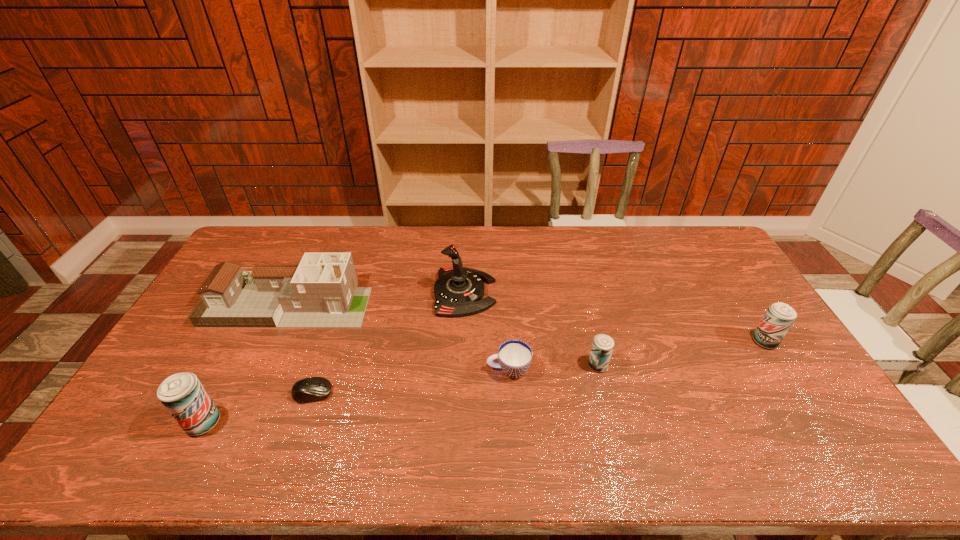
The image size is (960, 540). Find the location of `the leftmost beer can`. the leftmost beer can is located at coordinates pos(182,394).

The image size is (960, 540). I want to click on the tallest beer can, so click(182, 394).

Find the location of `the shortest beer can`. the shortest beer can is located at coordinates (602, 347).

The width and height of the screenshot is (960, 540). In order to click on the sixth object from left to right in this screenshot , I will do `click(602, 347)`.

Identify the location of the farthest beer can. The image size is (960, 540). (779, 317).

At what (x,y) coordinates should I click in order to perform the action: click on the rightmost beer can. Please return your answer as a coordinate pair (x, y). Image resolution: width=960 pixels, height=540 pixels. Looking at the image, I should click on (779, 317).

At what (x,y) coordinates should I click in order to perform the action: click on dollhouse. Please return your answer as a coordinate pair (x, y). The height and width of the screenshot is (540, 960). Looking at the image, I should click on (321, 292).

Find the location of a particular element. joystick is located at coordinates (459, 291).

I want to click on the sixth tallest object, so 514,356.

Find the location of a particular element. This screenshot has width=960, height=540. mouse is located at coordinates (311, 389).